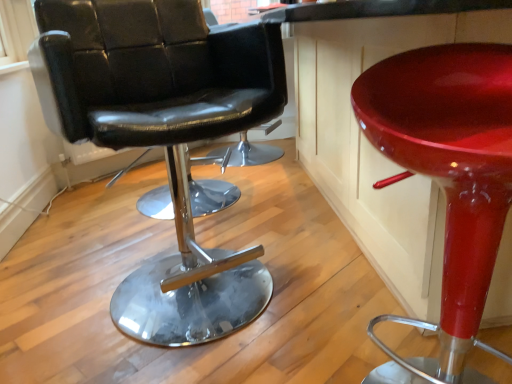
Question: Should I look upward or downward to see glossy red stool at right?

Choices:
 (A) down
 (B) up

Answer: (A)

Question: From the image's perspective, is glossy red stool at right under black leather chair at left?

Choices:
 (A) yes
 (B) no

Answer: (A)

Question: Considering the relative sizes of glossy red stool at right and black leather chair at left in the image provided, is glossy red stool at right wider than black leather chair at left?

Choices:
 (A) yes
 (B) no

Answer: (B)

Question: Is glossy red stool at right looking in the opposite direction of black leather chair at left?

Choices:
 (A) no
 (B) yes

Answer: (A)

Question: Can you confirm if glossy red stool at right is thinner than black leather chair at left?

Choices:
 (A) yes
 (B) no

Answer: (A)

Question: From a real-world perspective, is glossy red stool at right on top of black leather chair at left?

Choices:
 (A) yes
 (B) no

Answer: (B)

Question: Is glossy red stool at right outside black leather chair at left?

Choices:
 (A) yes
 (B) no

Answer: (A)

Question: Can you confirm if black leather chair at left is positioned to the left of glossy red stool at right?

Choices:
 (A) no
 (B) yes

Answer: (B)

Question: Is black leather chair at left not inside glossy red stool at right?

Choices:
 (A) yes
 (B) no

Answer: (A)

Question: Does black leather chair at left have a lesser width compared to glossy red stool at right?

Choices:
 (A) no
 (B) yes

Answer: (A)

Question: From the image's perspective, is black leather chair at left on top of glossy red stool at right?

Choices:
 (A) no
 (B) yes

Answer: (B)

Question: Can you confirm if black leather chair at left is smaller than glossy red stool at right?

Choices:
 (A) yes
 (B) no

Answer: (B)

Question: Is black leather chair at left at the right side of glossy red stool at right?

Choices:
 (A) no
 (B) yes

Answer: (A)

Question: Would you say glossy red stool at right is inside or outside black leather chair at left?

Choices:
 (A) outside
 (B) inside

Answer: (A)